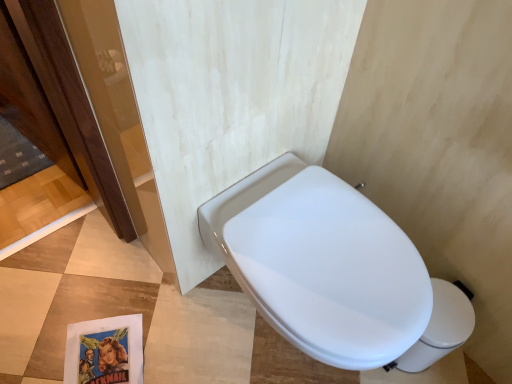
What is the approximate width of white glossy toilet bowl at lower right?

7.02 inches.

You are a GUI agent. You are given a task and a screenshot of the screen. Output one action in this format:
    pyautogui.click(x=<x>, y=<y>)
    Task: Click on the white glossy toilet bowl at lower right
    Image resolution: width=512 pixels, height=384 pixels.
    Given the screenshot: What is the action you would take?
    pyautogui.click(x=440, y=327)

Measure the distance between white glossy toilet bowl at lower right and camera.

The depth of white glossy toilet bowl at lower right is 38.90 inches.

What do you see at coordinates (440, 327) in the screenshot? I see `white glossy toilet bowl at lower right` at bounding box center [440, 327].

What do you see at coordinates (331, 271) in the screenshot?
I see `white glossy bidet at center` at bounding box center [331, 271].

Where is `white glossy bidet at center`? white glossy bidet at center is located at coordinates (331, 271).

Where is `white glossy toilet bowl at lower right`? The height and width of the screenshot is (384, 512). white glossy toilet bowl at lower right is located at coordinates (440, 327).

Considering the relative positions of white glossy bidet at center and white glossy toilet bowl at lower right in the image provided, is white glossy bidet at center to the left of white glossy toilet bowl at lower right from the viewer's perspective?

Correct, you'll find white glossy bidet at center to the left of white glossy toilet bowl at lower right.

Between white glossy bidet at center and white glossy toilet bowl at lower right, which one is positioned behind?

white glossy toilet bowl at lower right is behind.

Considering the points (265, 231) and (420, 359), which point is in front, point (265, 231) or point (420, 359)?

The point (265, 231) is closer.

From the image's perspective, which one is positioned lower, white glossy bidet at center or white glossy toilet bowl at lower right?

white glossy toilet bowl at lower right, from the image's perspective.

From a real-world perspective, is white glossy bidet at center under white glossy toilet bowl at lower right?

No.

Considering the sizes of objects white glossy bidet at center and white glossy toilet bowl at lower right in the image provided, who is thinner, white glossy bidet at center or white glossy toilet bowl at lower right?

white glossy toilet bowl at lower right is thinner.

Considering the sizes of objects white glossy bidet at center and white glossy toilet bowl at lower right in the image provided, who is shorter, white glossy bidet at center or white glossy toilet bowl at lower right?

Standing shorter between the two is white glossy toilet bowl at lower right.

Who is smaller, white glossy bidet at center or white glossy toilet bowl at lower right?

white glossy toilet bowl at lower right is smaller.

Is white glossy toilet bowl at lower right surrounded by white glossy bidet at center?

No, white glossy toilet bowl at lower right is not surrounded by white glossy bidet at center.

Is white glossy bidet at center touching white glossy toilet bowl at lower right?

No, white glossy bidet at center is not with white glossy toilet bowl at lower right.

Is white glossy bidet at center oriented towards white glossy toilet bowl at lower right?

No, white glossy bidet at center is not oriented towards white glossy toilet bowl at lower right.

Can you tell me how much white glossy bidet at center and white glossy toilet bowl at lower right differ in facing direction?

There is a 0.00166-degree angle between the facing directions of white glossy bidet at center and white glossy toilet bowl at lower right.

How far apart are white glossy bidet at center and white glossy toilet bowl at lower right?

white glossy bidet at center is 12.23 inches from white glossy toilet bowl at lower right.

Locate an element on the screen. Image resolution: width=512 pixels, height=384 pixels. bidet that is in front of the white glossy toilet bowl at lower right is located at coordinates [331, 271].

Based on their positions, is white glossy toilet bowl at lower right located to the left or right of white glossy bidet at center?

Based on their positions, white glossy toilet bowl at lower right is located to the right of white glossy bidet at center.

Considering their positions, is white glossy toilet bowl at lower right located in front of or behind white glossy bidet at center?

Visually, white glossy toilet bowl at lower right is located behind white glossy bidet at center.

Considering the positions of point (438, 304) and point (340, 305), is point (438, 304) closer or farther from the camera than point (340, 305)?

Point (438, 304) appears to be farther away from the viewer than point (340, 305).

From the image's perspective, is white glossy toilet bowl at lower right positioned above or below white glossy bidet at center?

Based on their image positions, white glossy toilet bowl at lower right is located beneath white glossy bidet at center.

From a real-world perspective, which object rests below the other?

white glossy toilet bowl at lower right, from a real-world perspective.

Can you confirm if white glossy toilet bowl at lower right is wider than white glossy bidet at center?

No.

Does white glossy toilet bowl at lower right have a greater height compared to white glossy bidet at center?

In fact, white glossy toilet bowl at lower right may be shorter than white glossy bidet at center.

Which of these two, white glossy toilet bowl at lower right or white glossy bidet at center, is bigger?

With larger size is white glossy bidet at center.

Is white glossy bidet at center inside white glossy toilet bowl at lower right?

Definitely not — white glossy bidet at center is not inside white glossy toilet bowl at lower right.

Is white glossy toilet bowl at lower right far from white glossy bidet at center?

They are positioned close to each other.

Is white glossy toilet bowl at lower right positioned with its back to white glossy bidet at center?

No, white glossy toilet bowl at lower right is not facing away from white glossy bidet at center.

In the scene shown: Can you tell me how much white glossy toilet bowl at lower right and white glossy bidet at center differ in facing direction?

The angular difference between white glossy toilet bowl at lower right and white glossy bidet at center is 0.00166 degrees.

Where is `bidet located above the white glossy toilet bowl at lower right (from the image's perspective)`? The image size is (512, 384). bidet located above the white glossy toilet bowl at lower right (from the image's perspective) is located at coordinates (331, 271).

Locate an element on the screen. toilet bowl on the right side of white glossy bidet at center is located at coordinates pos(440,327).

In the image, there is a white glossy toilet bowl at lower right. Identify the location of bidet above it (from the image's perspective). The image size is (512, 384). (331, 271).